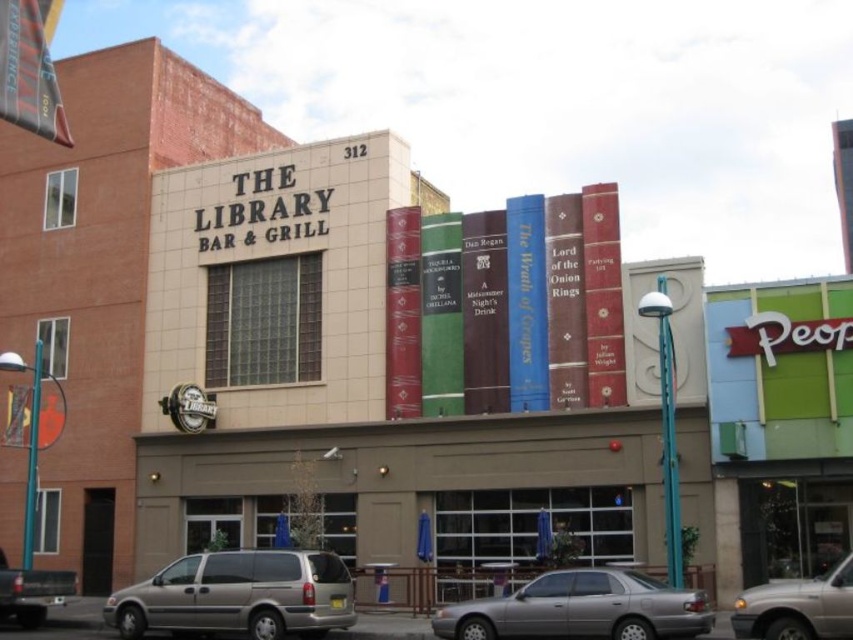
Question: Is gold metallic minivan at lower center closer to camera compared to metallic silver van at lower right?

Choices:
 (A) no
 (B) yes

Answer: (A)

Question: Considering the real-world distances, which object is closest to the gold metallic minivan at lower center?

Choices:
 (A) metallic silver van at lower right
 (B) silver metallic sedan at lower center
 (C) matte silver van at lower left

Answer: (B)

Question: Can you confirm if gold metallic minivan at lower center is positioned below matte silver van at lower left?

Choices:
 (A) no
 (B) yes

Answer: (A)

Question: Among these objects, which one is nearest to the camera?

Choices:
 (A) silver metallic sedan at lower center
 (B) metallic silver van at lower right

Answer: (B)

Question: Which object appears closest to the camera in this image?

Choices:
 (A) metallic silver van at lower right
 (B) matte silver van at lower left

Answer: (A)

Question: Can you confirm if gold metallic minivan at lower center is positioned above silver metallic sedan at lower center?

Choices:
 (A) no
 (B) yes

Answer: (A)